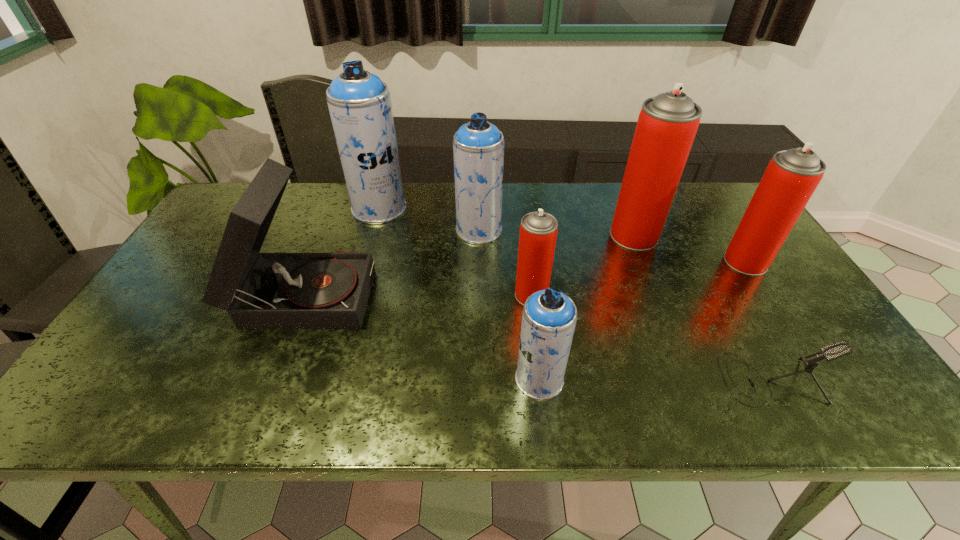
You are a GUI agent. You are given a task and a screenshot of the screen. Output one action in this format:
    pyautogui.click(x=<x>, y=<y>)
    Task: Click on the vacant space in between the second biggest blue aerosol can and the phonograph_record
    This screenshot has width=960, height=540.
    Given the screenshot: What is the action you would take?
    pyautogui.click(x=392, y=260)

This screenshot has width=960, height=540. I want to click on empty location between the microphone and the leftmost aerosol can, so click(x=575, y=293).

The height and width of the screenshot is (540, 960). I want to click on empty location between the nearest aerosol can and the rightmost aerosol can, so click(642, 320).

Identify which object is located as the fifth nearest to the second smallest red aerosol can. Please provide its 2D coordinates. Your answer should be formatted as a tuple, i.e. [(x, y)], where the tuple contains the x and y coordinates of a point satisfying the conditions above.

[(478, 146)]

The image size is (960, 540). What are the coordinates of `the third closest object to the leftmost aerosol can` in the screenshot? It's located at (538, 230).

Where is `the closest aerosol can to the second aerosol can from right to left`? This screenshot has height=540, width=960. the closest aerosol can to the second aerosol can from right to left is located at coordinates (791, 177).

Choose which aerosol can is the nearest neighbor to the leftmost blue aerosol can. Please provide its 2D coordinates. Your answer should be formatted as a tuple, i.e. [(x, y)], where the tuple contains the x and y coordinates of a point satisfying the conditions above.

[(478, 146)]

Find the location of `red aerosol can that is the second closest to the phonograph_record`. red aerosol can that is the second closest to the phonograph_record is located at coordinates (667, 124).

Select which red aerosol can appears as the closest to the biggest red aerosol can. Please provide its 2D coordinates. Your answer should be formatted as a tuple, i.e. [(x, y)], where the tuple contains the x and y coordinates of a point satisfying the conditions above.

[(791, 177)]

Image resolution: width=960 pixels, height=540 pixels. Identify the location of blue aerosol can that stands as the third closest to the fifth farthest aerosol can. (359, 103).